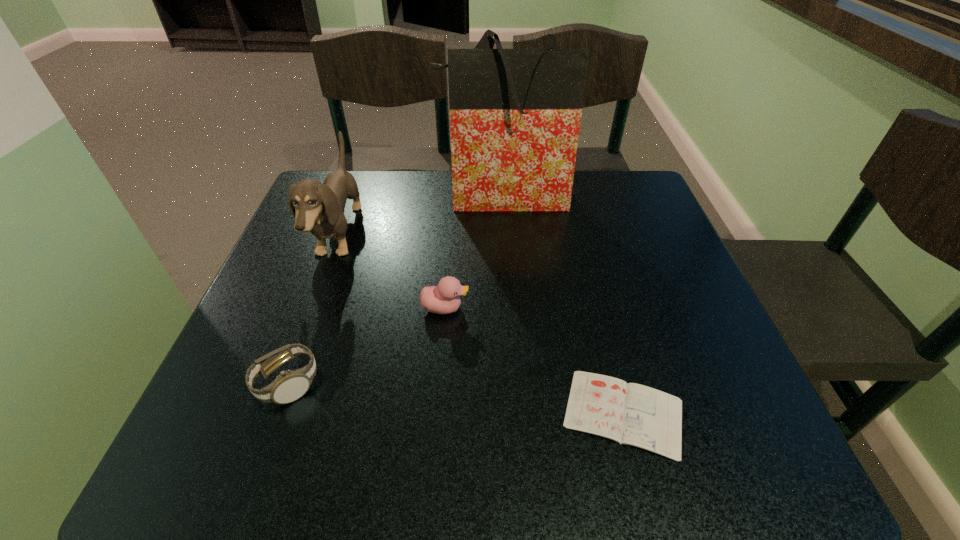
Find the location of a particular element. shopping bag is located at coordinates (515, 114).

Where is `puppy`? The height and width of the screenshot is (540, 960). puppy is located at coordinates (319, 208).

Identify the location of duckling. This screenshot has width=960, height=540. (444, 298).

Where is `watch`? The image size is (960, 540). watch is located at coordinates (289, 386).

Locate an element on the screen. This screenshot has height=540, width=960. the shortest object is located at coordinates (628, 413).

Where is `vacant region located 0.310m on the front side of the shopping bag`? The image size is (960, 540). vacant region located 0.310m on the front side of the shopping bag is located at coordinates (510, 310).

What are the coordinates of `vacant space located at the face of the fourth shortest object` in the screenshot? It's located at (457, 235).

This screenshot has width=960, height=540. Find the location of `vacant space located 0.330m on the front-facing side of the third farthest object`. vacant space located 0.330m on the front-facing side of the third farthest object is located at coordinates (637, 308).

Where is `vacant space located 0.250m on the face of the watch`? vacant space located 0.250m on the face of the watch is located at coordinates (x=466, y=383).

This screenshot has height=540, width=960. Identify the location of vacant space situated 0.120m on the back of the diary. (599, 319).